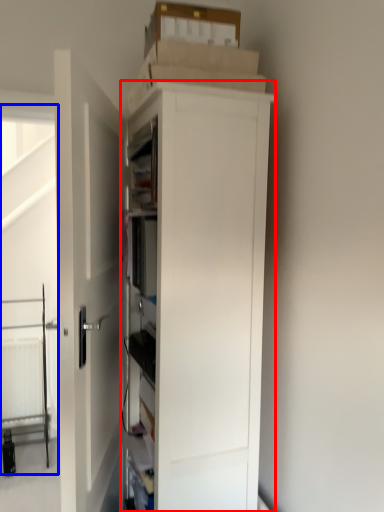
Question: Among these objects, which one is nearest to the camera, cupboard (highlighted by a red box) or screen door (highlighted by a blue box)?

Choices:
 (A) cupboard
 (B) screen door

Answer: (A)